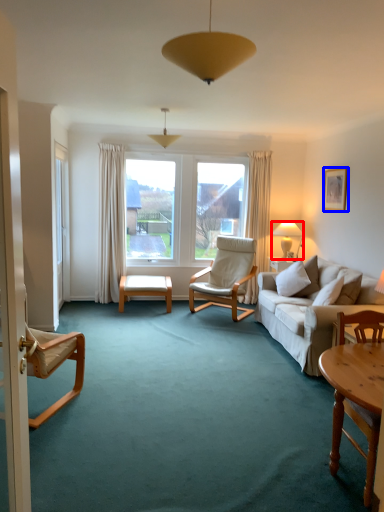
Question: Which object appears closest to the camera in this image, lamp (highlighted by a red box) or picture frame (highlighted by a blue box)?

Choices:
 (A) lamp
 (B) picture frame

Answer: (B)